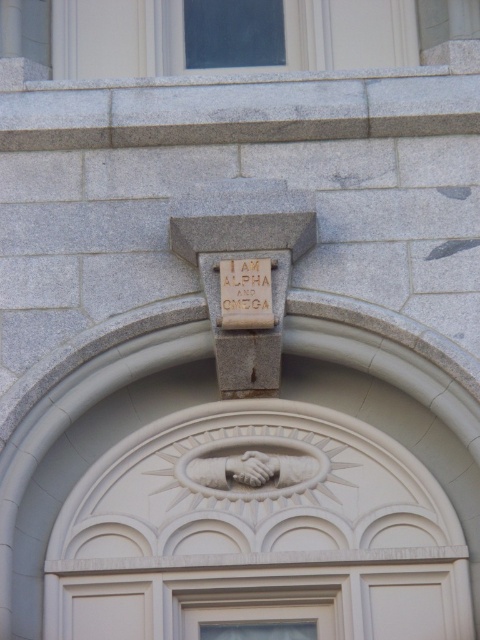
You are an architect designing a new building and want to replicate the facade shown. You need to ensure the white painted wood door at center and the red stone inscription at center are proportionate. Which object should be wider when constructing them?

The white painted wood door at center should be wider than the red stone inscription at center since its width is larger according to the description.

You are standing in front of the building and notice the white painted wood door at center and the red stone inscription at center. Which one is positioned higher up?

The red stone inscription at center is positioned higher up because it is above the white painted wood door at center.